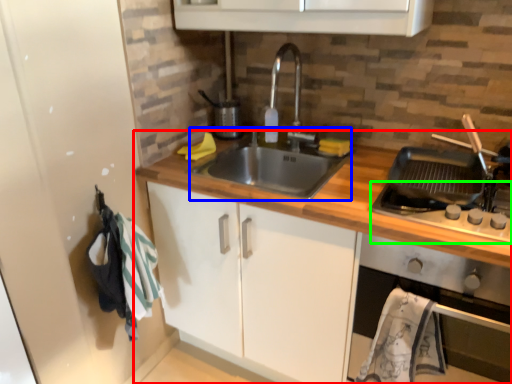
Question: Considering the real-world distances, which object is farthest from countertop (highlighted by a red box)? sink (highlighted by a blue box) or gas stove (highlighted by a green box)?

Choices:
 (A) sink
 (B) gas stove

Answer: (B)